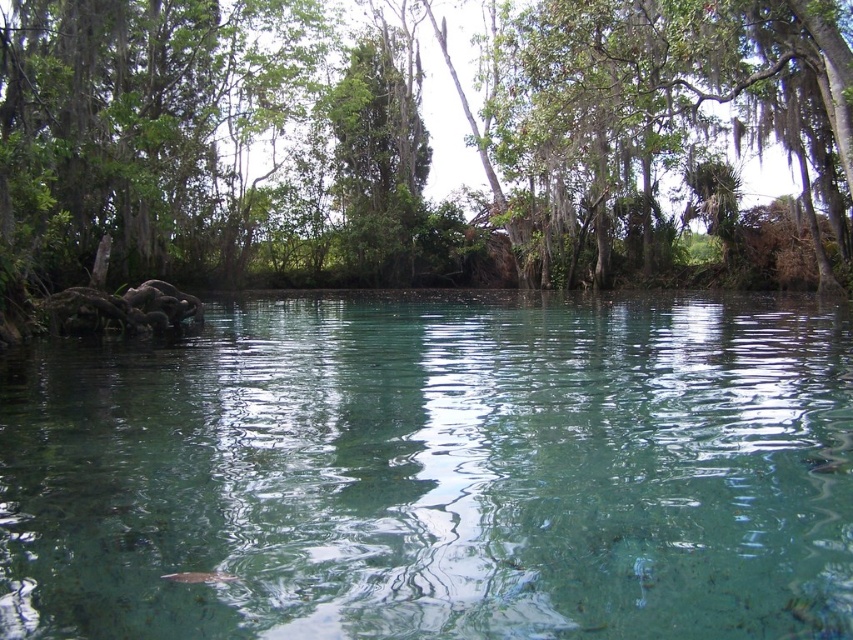
Question: Is clear water at center positioned behind green leafy tree at center?

Choices:
 (A) no
 (B) yes

Answer: (A)

Question: In this image, where is clear water at center located relative to green leafy tree at center?

Choices:
 (A) right
 (B) left

Answer: (A)

Question: Which object is farther from the camera taking this photo?

Choices:
 (A) clear water at center
 (B) green leafy tree at center

Answer: (B)

Question: Can you confirm if clear water at center is positioned to the right of green leafy tree at center?

Choices:
 (A) yes
 (B) no

Answer: (A)

Question: Which of the following is the farthest from the observer?

Choices:
 (A) green leafy tree at center
 (B) clear water at center

Answer: (A)

Question: Which point is farther to the camera?

Choices:
 (A) green leafy tree at center
 (B) clear water at center

Answer: (A)